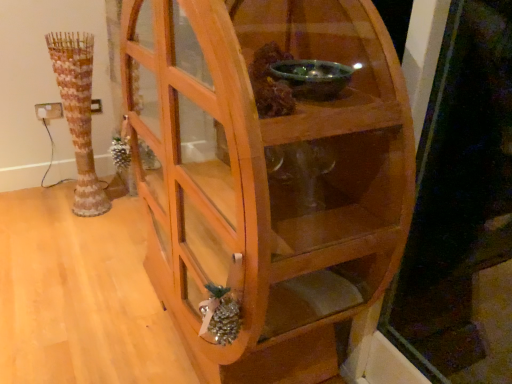
Question: From their relative heights in the image, would you say wooden cabinet at center is taller or shorter than wooden textured vase at left?

Choices:
 (A) short
 (B) tall

Answer: (B)

Question: From a real-world perspective, is wooden cabinet at center positioned above or below wooden textured vase at left?

Choices:
 (A) above
 (B) below

Answer: (A)

Question: From the image's perspective, is wooden cabinet at center located above or below wooden textured vase at left?

Choices:
 (A) below
 (B) above

Answer: (A)

Question: Considering the positions of point (74, 87) and point (352, 137), is point (74, 87) closer or farther from the camera than point (352, 137)?

Choices:
 (A) closer
 (B) farther

Answer: (B)

Question: From the image's perspective, is wooden textured vase at left above or below wooden cabinet at center?

Choices:
 (A) below
 (B) above

Answer: (B)

Question: From a real-world perspective, is wooden textured vase at left physically located above or below wooden cabinet at center?

Choices:
 (A) above
 (B) below

Answer: (B)

Question: In terms of width, does wooden textured vase at left look wider or thinner when compared to wooden cabinet at center?

Choices:
 (A) thin
 (B) wide

Answer: (A)